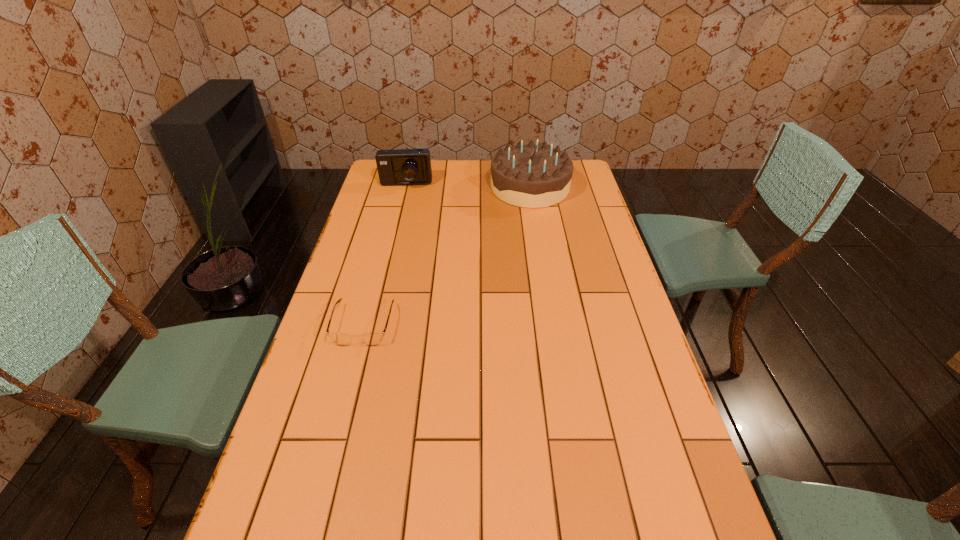
At what (x,y) coordinates should I click in order to perform the action: click on camera at the far edge. Please return your answer as a coordinate pair (x, y). The image size is (960, 540). Looking at the image, I should click on (401, 166).

The image size is (960, 540). Identify the location of camera that is positioned at the left edge. (401, 166).

Image resolution: width=960 pixels, height=540 pixels. What are the coordinates of `spectacles present at the left edge` in the screenshot? It's located at (372, 339).

The width and height of the screenshot is (960, 540). Find the location of `object that is at the right edge`. object that is at the right edge is located at coordinates (526, 175).

Identify the location of object that is positioned at the far left corner. (401, 166).

Image resolution: width=960 pixels, height=540 pixels. Find the location of `object that is at the far right corner`. object that is at the far right corner is located at coordinates (526, 175).

At what (x,y) coordinates should I click in order to perform the action: click on free space at the far edge of the desktop. Please return your answer as a coordinate pair (x, y). Image resolution: width=960 pixels, height=540 pixels. Looking at the image, I should click on (447, 165).

Find the location of a particular element. This screenshot has height=540, width=960. free space at the left edge is located at coordinates (390, 253).

Where is `blank space at the right edge of the desktop`? blank space at the right edge of the desktop is located at coordinates (605, 315).

Image resolution: width=960 pixels, height=540 pixels. What are the coordinates of `empty space between the rightmost object and the camera` in the screenshot? It's located at (468, 186).